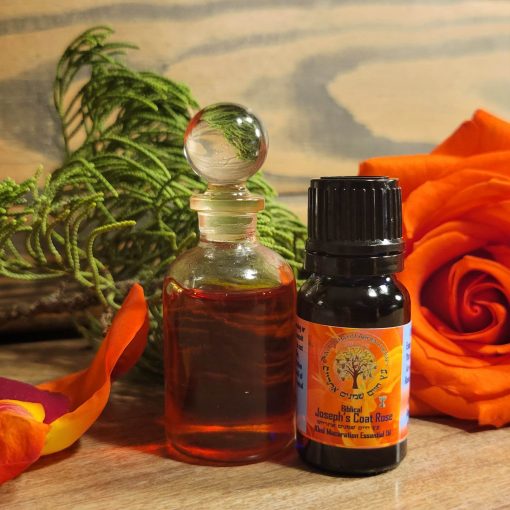
Identify the location of glass ball. (223, 146).